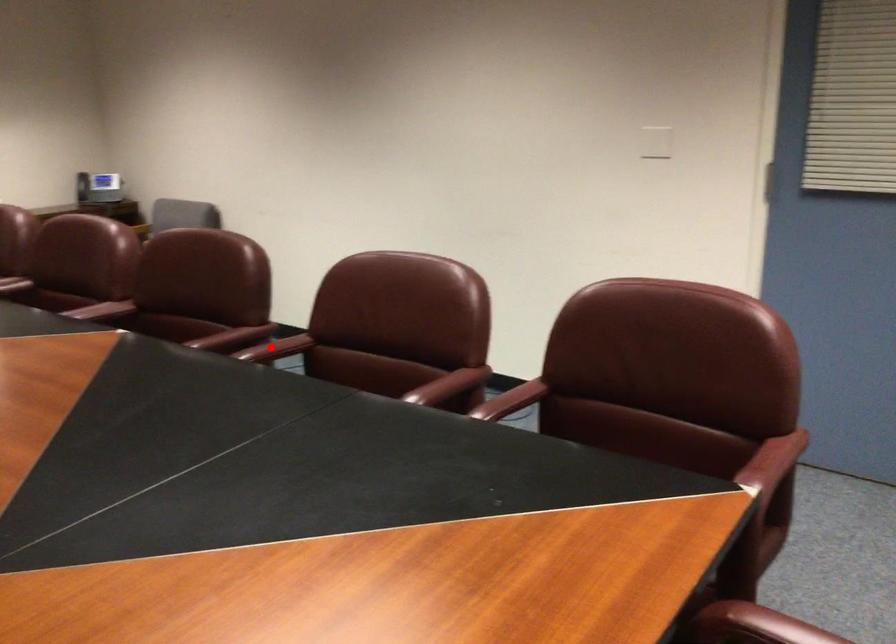
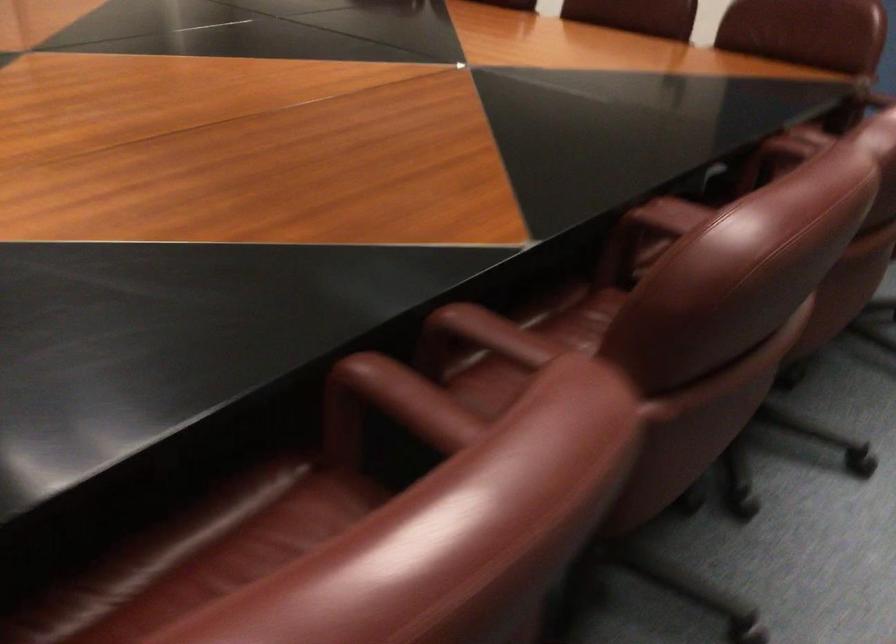
Where in the second image is the point corresponding to the highlighted location from the first image?

(392, 404)